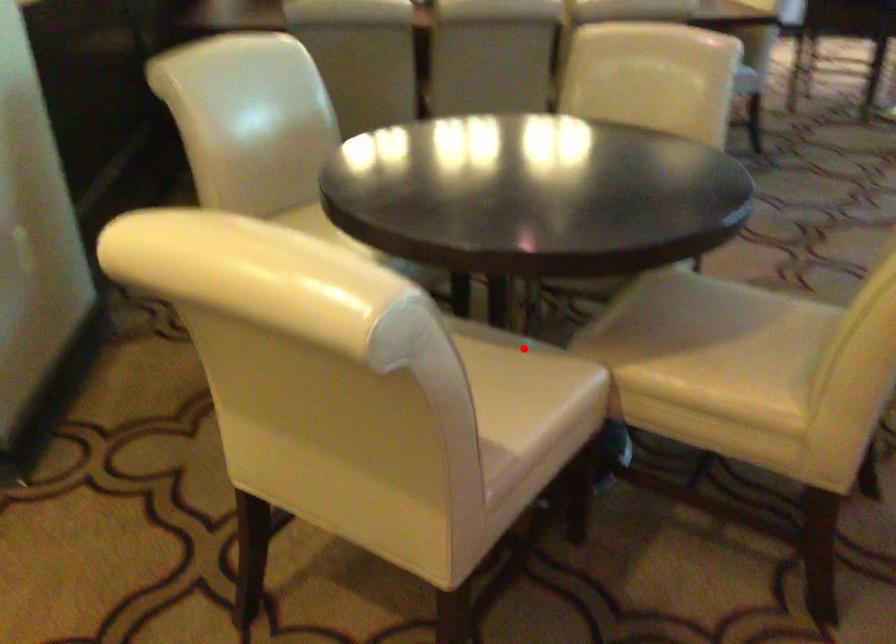
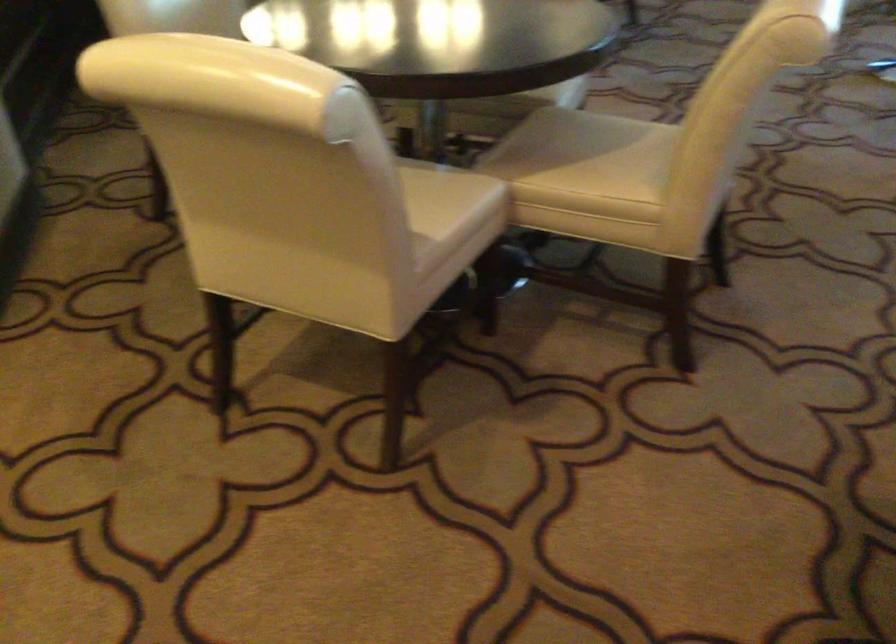
Question: I am providing you with two images of the same scene from different viewpoints. A red point is marked on the first image. Can you still see the location of the red point in image 2?

Choices:
 (A) Yes
 (B) No

Answer: (A)